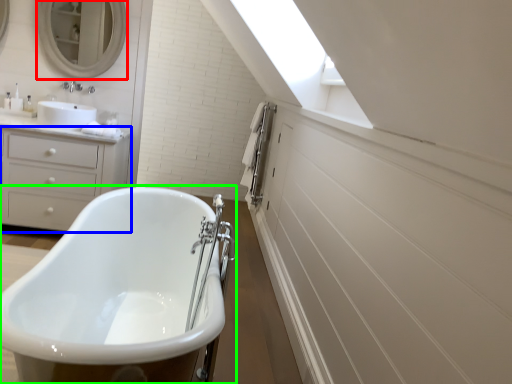
Question: Which object is the closest to the mirror (highlighted by a red box)? Choose among these: chest of drawers (highlighted by a blue box) or bathtub (highlighted by a green box).

Choices:
 (A) chest of drawers
 (B) bathtub

Answer: (A)